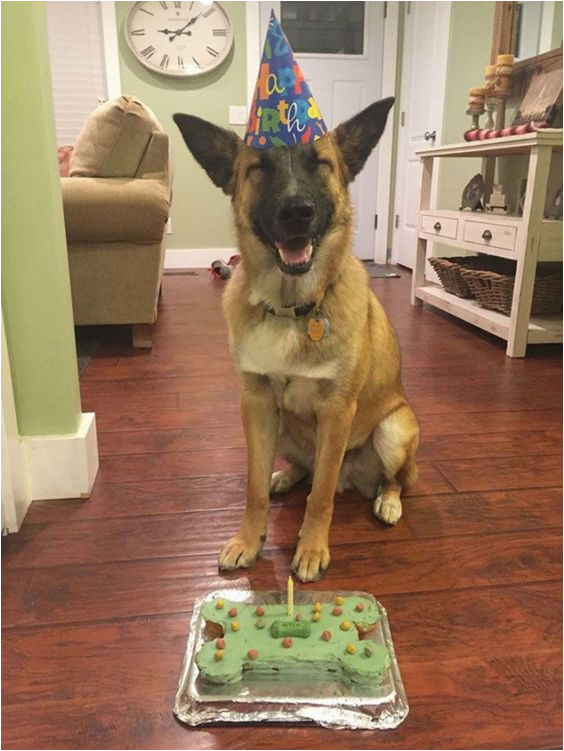
You are a GUI agent. You are given a task and a screenshot of the screen. Output one action in this format:
    pyautogui.click(x=<x>, y=<y>)
    Task: Click on the walls
    
    Given the screenshot: What is the action you would take?
    pyautogui.click(x=58, y=339), pyautogui.click(x=197, y=109), pyautogui.click(x=466, y=44)